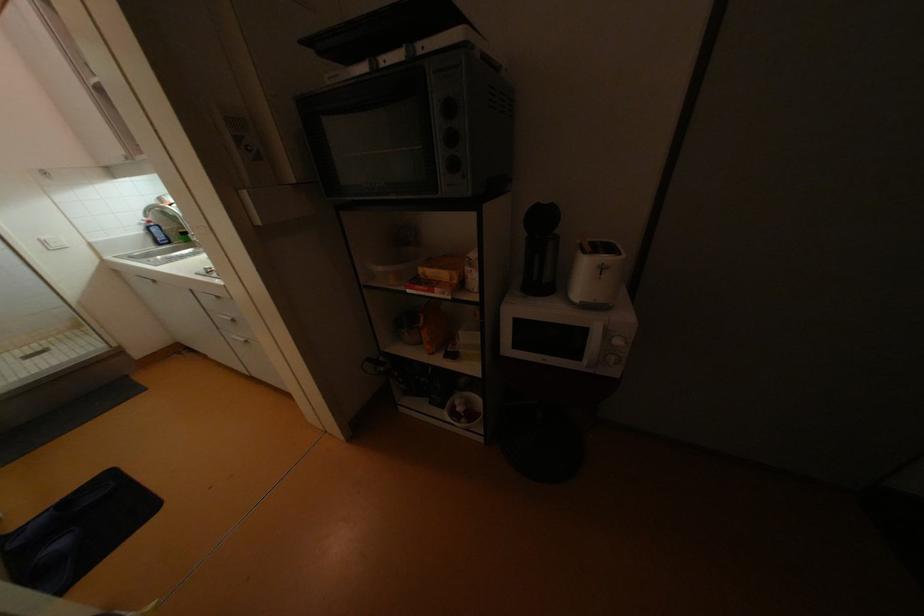
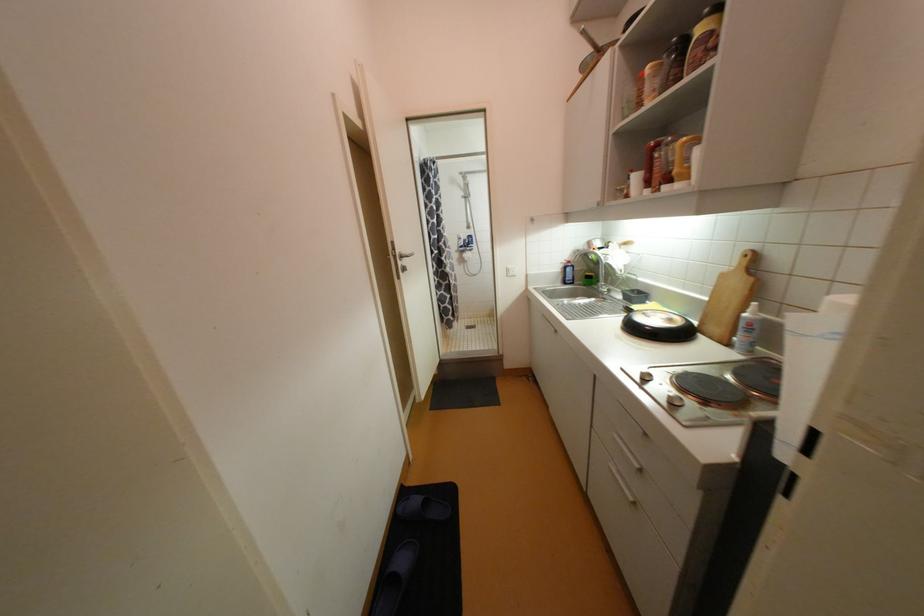
In the second image, find the point that corresponds to point (209, 275) in the first image.

(642, 379)